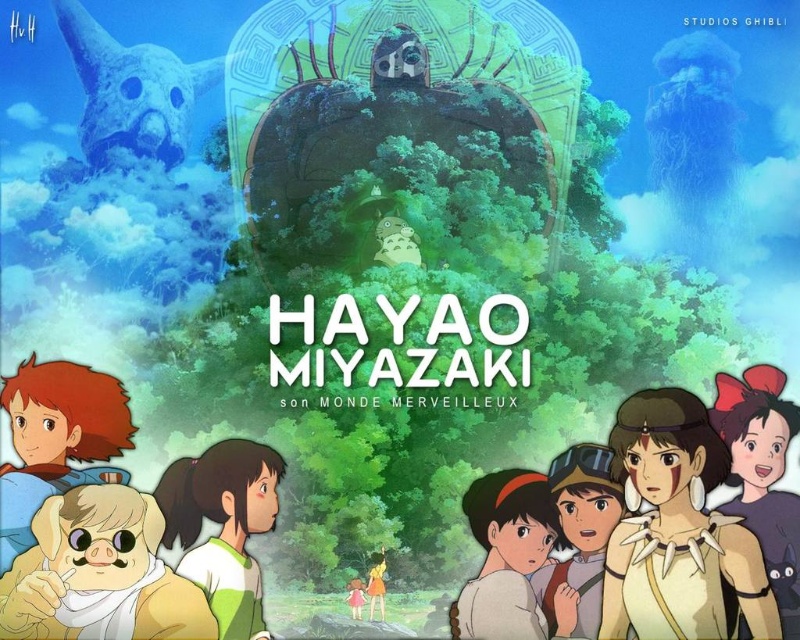
Looking at the vibrant Miyazaki illustration, you notice two characters with distinct features. The first has soft yellow fur at lower left, and the second has smooth brown hair at right. Which character appears taller in the artwork?

The soft yellow fur at lower left is much taller than smooth brown hair at right, so the character with soft yellow fur at lower left appears taller.

You are designing a poster and want to place a border around both the brown fur dog at lower left and the green matte shirt at center. Which object requires a wider border to fit properly?

The green matte shirt at center requires a wider border because its width is greater than the brown fur dog at lower left.

You are an observer looking at the Miyazaki illustration. You notice two characters with distinct features. The first has soft yellow fur at lower left, and the second has smooth brown hair at right. Which character is positioned closer to you?

The soft yellow fur at lower left is closer to the viewer than smooth brown hair at right.